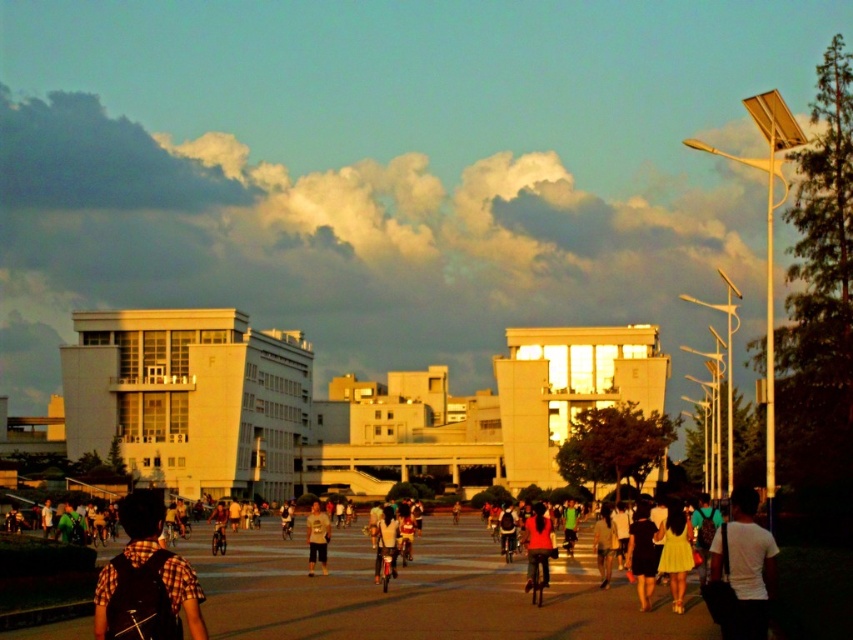
Question: Does black matte dress at lower right appear over matte red shirt at center?

Choices:
 (A) no
 (B) yes

Answer: (B)

Question: Based on their relative distances, which object is nearer to the matte red shirt at center?

Choices:
 (A) dark blue jeans at center
 (B) light gray cotton shirt at center

Answer: (A)

Question: Does black matte dress at lower right appear on the left side of light gray cotton shirt at center?

Choices:
 (A) no
 (B) yes

Answer: (A)

Question: Which point appears closest to the camera in this image?

Choices:
 (A) (683, 561)
 (B) (68, 529)
 (C) (96, 624)

Answer: (C)

Question: Which point is farther to the camera?

Choices:
 (A) (732, 627)
 (B) (596, 566)
 (C) (628, 552)
 (D) (540, 516)

Answer: (B)

Question: Does white matte shirt at center-right appear on the left side of dark blue jeans at center?

Choices:
 (A) no
 (B) yes

Answer: (A)